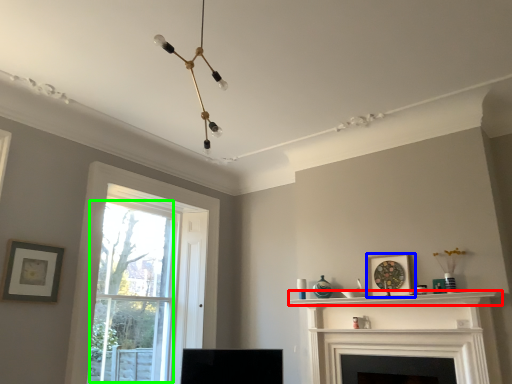
Question: Based on their relative distances, which object is farther from shelf (highlighted by a red box)? Choose from picture frame (highlighted by a blue box) and bay window (highlighted by a green box).

Choices:
 (A) picture frame
 (B) bay window

Answer: (B)